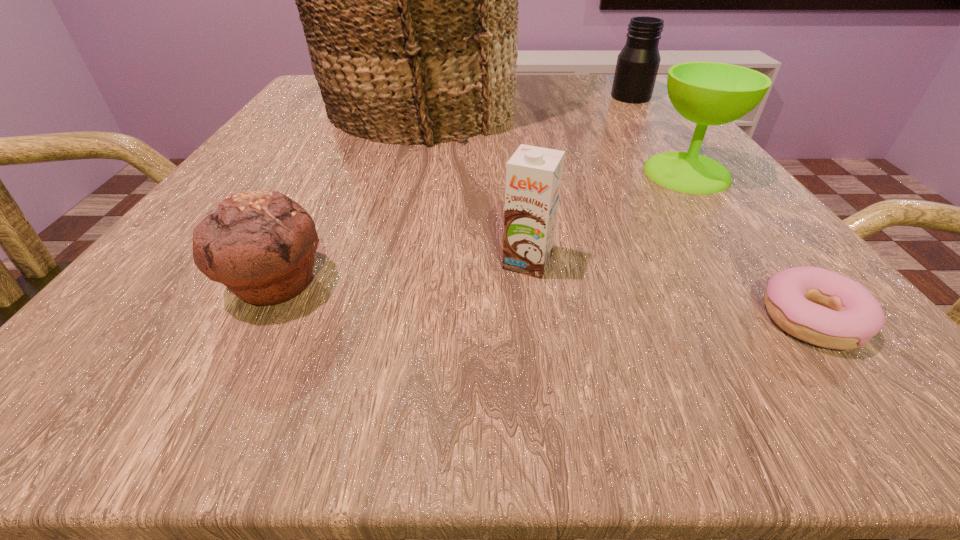
You are a GUI agent. You are given a task and a screenshot of the screen. Output one action in this format:
    pyautogui.click(x=<x>, y=<y>)
    Task: Click on the basket
    The height and width of the screenshot is (540, 960).
    Given the screenshot: What is the action you would take?
    pyautogui.click(x=409, y=0)

Find the location of a particular element. jar is located at coordinates (637, 66).

At what (x,y) coordinates should I click in order to perform the action: click on the fourth nearest object. Please return your answer as a coordinate pair (x, y). Looking at the image, I should click on click(708, 93).

This screenshot has width=960, height=540. What are the coordinates of `chocolate milk` in the screenshot? It's located at (533, 174).

You are a GUI agent. You are given a task and a screenshot of the screen. Output one action in this format:
    pyautogui.click(x=<x>, y=<y>)
    Task: Click on the muffin
    
    Given the screenshot: What is the action you would take?
    click(260, 244)

Where is `doughnut`? The height and width of the screenshot is (540, 960). doughnut is located at coordinates (824, 308).

Where is `vacant position located 0.090m on the front of the tallest object`? vacant position located 0.090m on the front of the tallest object is located at coordinates (397, 180).

Find the location of a particular element. The height and width of the screenshot is (540, 960). vacant space located on the front of the jar is located at coordinates (688, 174).

Locate an element on the screen. The image size is (960, 540). free space located on the left of the wineglass is located at coordinates (541, 173).

Where is `vacant space located 0.380m on the back of the chocolate milk`? Image resolution: width=960 pixels, height=540 pixels. vacant space located 0.380m on the back of the chocolate milk is located at coordinates (510, 124).